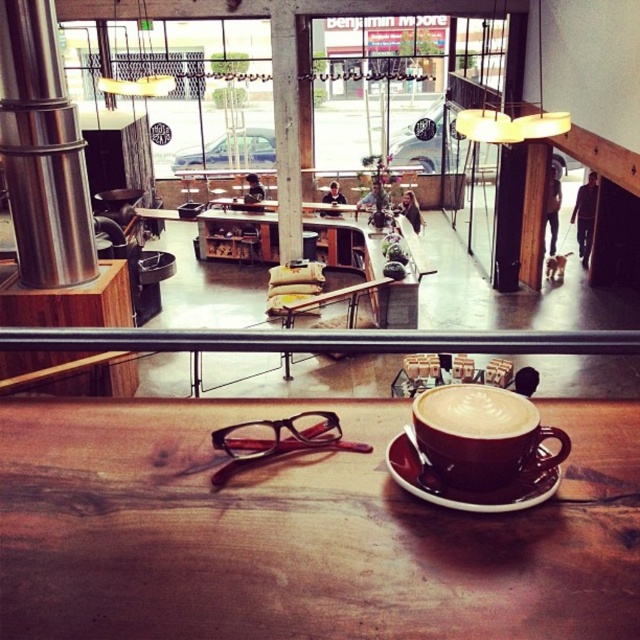
Question: Is wooden table at center below matte brown cup at center?

Choices:
 (A) no
 (B) yes

Answer: (B)

Question: Among these points, which one is nearest to the camera?

Choices:
 (A) (460, 403)
 (B) (385, 460)
 (C) (497, 406)

Answer: (C)

Question: Which point is farther to the camera?

Choices:
 (A) (436, 388)
 (B) (70, 550)

Answer: (A)

Question: Among these objects, which one is farthest from the camera?

Choices:
 (A) cappuccino foam at center
 (B) brown ceramic saucer at center
 (C) wooden table at center

Answer: (B)

Question: Does cappuccino foam at center appear on the right side of brown ceramic saucer at center?

Choices:
 (A) yes
 (B) no

Answer: (A)

Question: Can you confirm if matte brown cup at center is thinner than brown ceramic saucer at center?

Choices:
 (A) no
 (B) yes

Answer: (A)